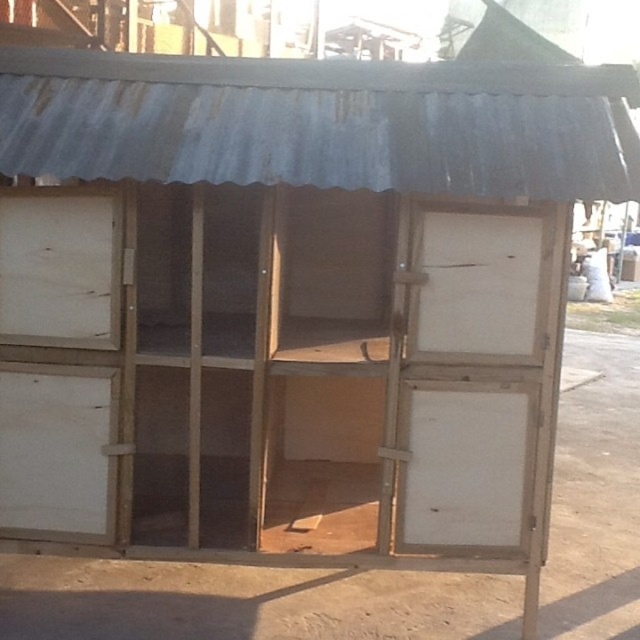
Question: Is white matte drawer at lower left behind white matte drawer at left?

Choices:
 (A) yes
 (B) no

Answer: (A)

Question: Does white matte drawer at lower left come in front of white matte drawer at left?

Choices:
 (A) yes
 (B) no

Answer: (B)

Question: Which of the following is the farthest from the observer?

Choices:
 (A) white matte drawer at lower left
 (B) white matte drawer at left

Answer: (A)

Question: Is white matte drawer at lower left below white matte drawer at left?

Choices:
 (A) no
 (B) yes

Answer: (B)

Question: Among these points, which one is farthest from the camera?

Choices:
 (A) (29, 285)
 (B) (61, 480)

Answer: (B)